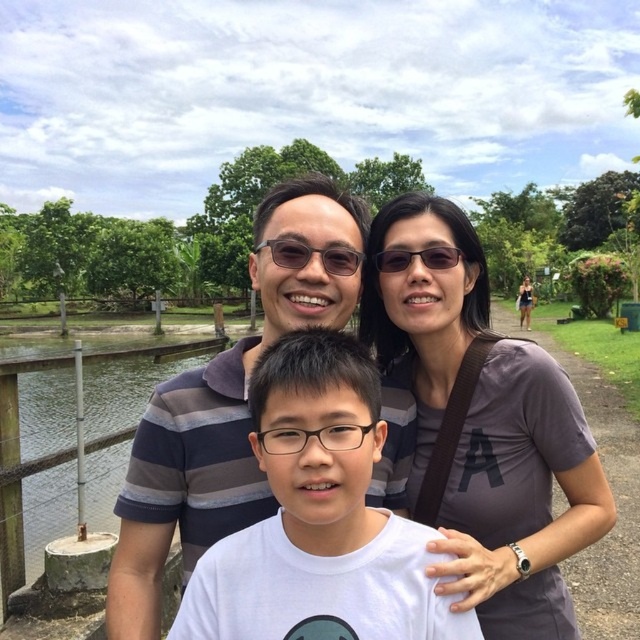
You are a photographer adjusting the focus on your camera. You need to ensure both the gray fabric shirt at upper center and the matte black glasses at center are in focus. Given that your camera can only focus on objects within a 15 inch range, will both items be in focus?

The gray fabric shirt at upper center is 17.50 inches from matte black glasses at center. Since the distance between them exceeds the camera focus range of 15 inches, the camera cannot keep both items in focus simultaneously.